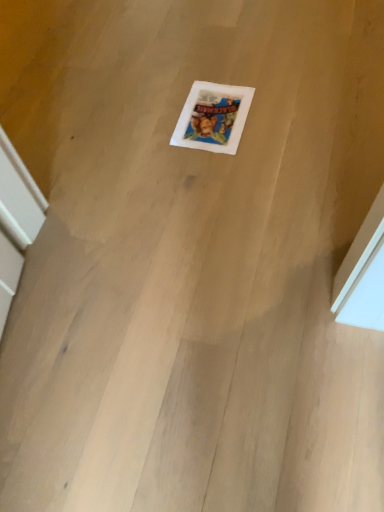
Locate an element on the screen. Image resolution: width=384 pixels, height=512 pixels. unoccupied region to the right of white matte picture frame at center is located at coordinates (285, 106).